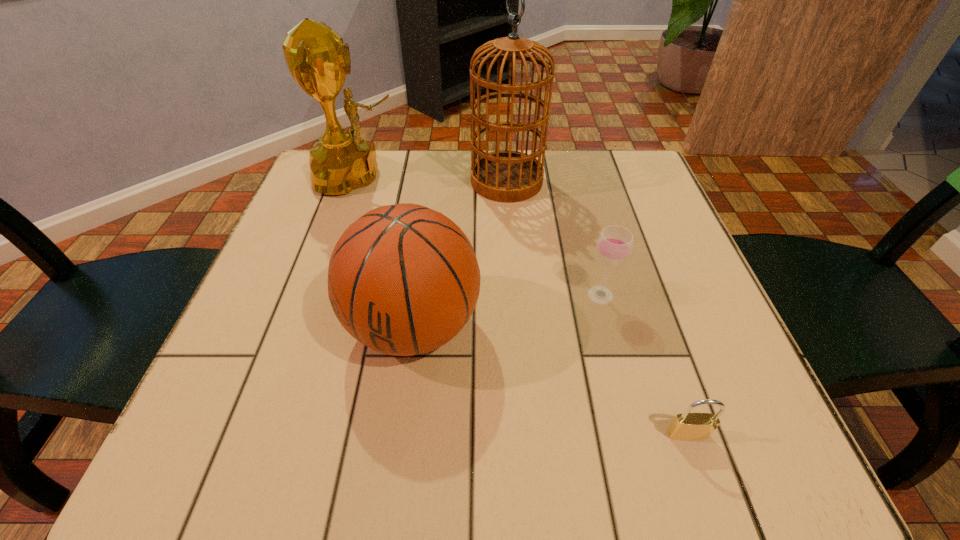
In the image, there is a desktop. In order to click on vacant region at the left edge in this screenshot , I will do `click(277, 351)`.

Find the location of `free region at the right edge of the desktop`. free region at the right edge of the desktop is located at coordinates (681, 282).

The image size is (960, 540). I want to click on vacant space at the far right corner of the desktop, so click(x=593, y=163).

Where is `empty space between the fourth tallest object and the basketball`? The height and width of the screenshot is (540, 960). empty space between the fourth tallest object and the basketball is located at coordinates (507, 311).

Locate an element on the screen. vacant region between the fourth object from left to right and the basketball is located at coordinates (507, 311).

Locate an element on the screen. The image size is (960, 540). vacant area that lies between the award and the nearest object is located at coordinates (523, 306).

Locate an element on the screen. vacant area between the shortest object and the fourth object from left to right is located at coordinates (644, 364).

The image size is (960, 540). I want to click on unoccupied position between the rightmost object and the fourth tallest object, so click(x=644, y=364).

The width and height of the screenshot is (960, 540). Identify the location of free space between the birdcage and the wineglass. (554, 238).

Locate an element on the screen. The width and height of the screenshot is (960, 540). free space that is in between the birdcage and the wineglass is located at coordinates (554, 238).